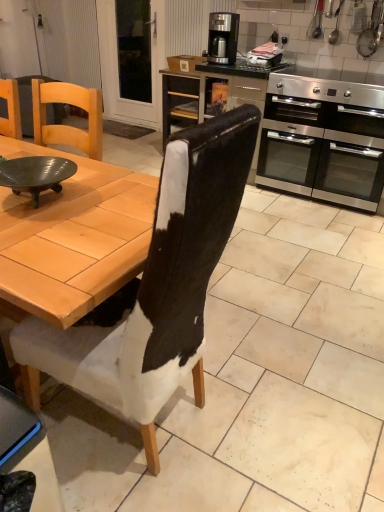
Question: Can you confirm if metallic silver pot at upper right, positioned as the 1th appliance in right-to-left order, is thinner than black leather chair at center?

Choices:
 (A) yes
 (B) no

Answer: (A)

Question: Can you confirm if metallic silver pot at upper right, which appears as the 2th appliance when viewed from the left, is taller than black leather chair at center?

Choices:
 (A) no
 (B) yes

Answer: (A)

Question: Is metallic silver pot at upper right, positioned as the 1th appliance in right-to-left order, not within black leather chair at center?

Choices:
 (A) no
 (B) yes

Answer: (B)

Question: Is metallic silver pot at upper right, which appears as the 2th appliance when viewed from the left, positioned far away from black leather chair at center?

Choices:
 (A) yes
 (B) no

Answer: (A)

Question: Is black leather chair at center completely or partially inside metallic silver pot at upper right, which appears as the 2th appliance when viewed from the left?

Choices:
 (A) no
 (B) yes

Answer: (A)

Question: Can you confirm if metallic silver pot at upper right, positioned as the 1th appliance in right-to-left order, is smaller than black leather chair at center?

Choices:
 (A) no
 (B) yes

Answer: (B)

Question: Is the depth of metallic silver oven at center right less than that of stainless steel oven at right?

Choices:
 (A) yes
 (B) no

Answer: (B)

Question: Is metallic silver oven at center right wider than stainless steel oven at right?

Choices:
 (A) yes
 (B) no

Answer: (B)

Question: Is metallic silver oven at center right oriented away from stainless steel oven at right?

Choices:
 (A) yes
 (B) no

Answer: (B)

Question: Would you say metallic silver oven at center right is outside stainless steel oven at right?

Choices:
 (A) no
 (B) yes

Answer: (B)

Question: Does metallic silver oven at center right turn towards stainless steel oven at right?

Choices:
 (A) no
 (B) yes

Answer: (A)

Question: Can you confirm if metallic silver oven at center right is smaller than stainless steel oven at right?

Choices:
 (A) no
 (B) yes

Answer: (B)

Question: Can you confirm if matte black bowl at left is thinner than metallic silver toaster at upper center, the first appliance from the left?

Choices:
 (A) yes
 (B) no

Answer: (B)